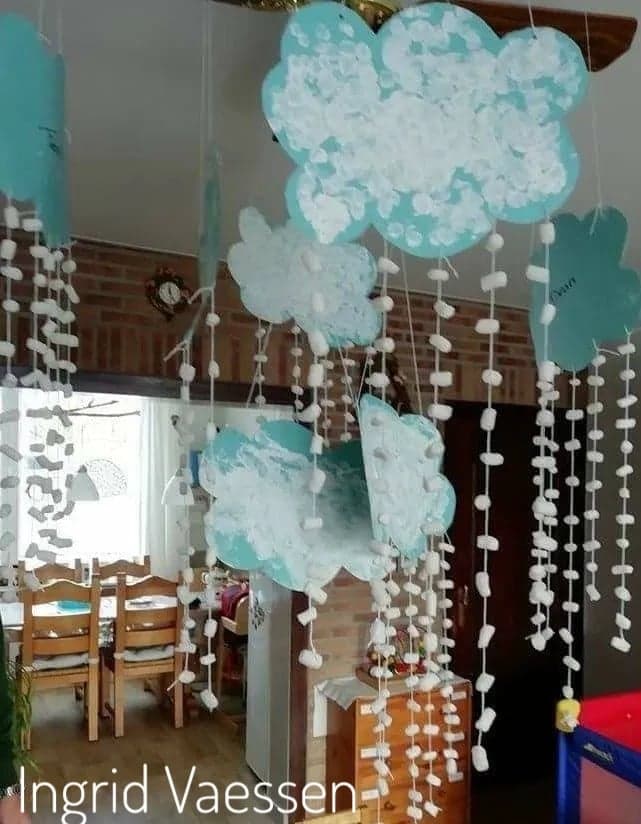
Find the location of a particular element. This screenshot has width=641, height=824. curtain is located at coordinates point(156,512).